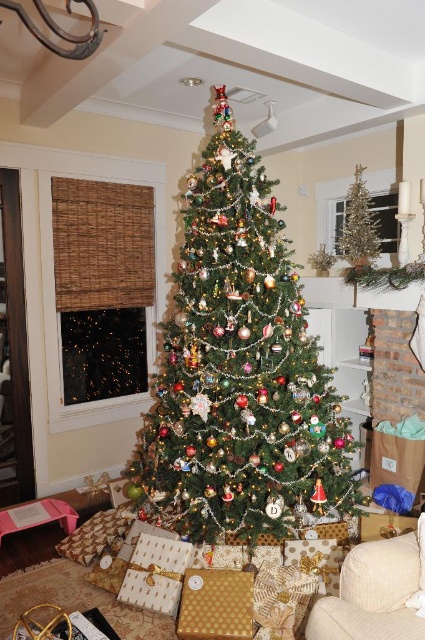
Between point (215, 161) and point (326, 616), which one is positioned behind?

Point (215, 161)

Between point (345, 422) and point (348, 637), which one is positioned in front?

Point (348, 637) is in front.

The height and width of the screenshot is (640, 425). What do you see at coordinates (238, 371) in the screenshot? I see `green matte christmas tree at center` at bounding box center [238, 371].

Find the location of a particular element. green matte christmas tree at center is located at coordinates (238, 371).

Is green matte christmas tree at center smaller than gold textured gift at lower center?

Incorrect, green matte christmas tree at center is not smaller in size than gold textured gift at lower center.

Image resolution: width=425 pixels, height=640 pixels. What are the coordinates of `green matte christmas tree at center` in the screenshot? It's located at (238, 371).

Between point (404, 621) and point (217, 625), which one is positioned behind?

Point (217, 625)

Does point (379, 612) lie in front of point (190, 612)?

Yes, point (379, 612) is in front of point (190, 612).

At what (x,y) coordinates should I click in order to perform the action: click on beige fabric armchair at lower right. Please return your answer as a coordinate pair (x, y). The image size is (425, 640). Looking at the image, I should click on (376, 593).